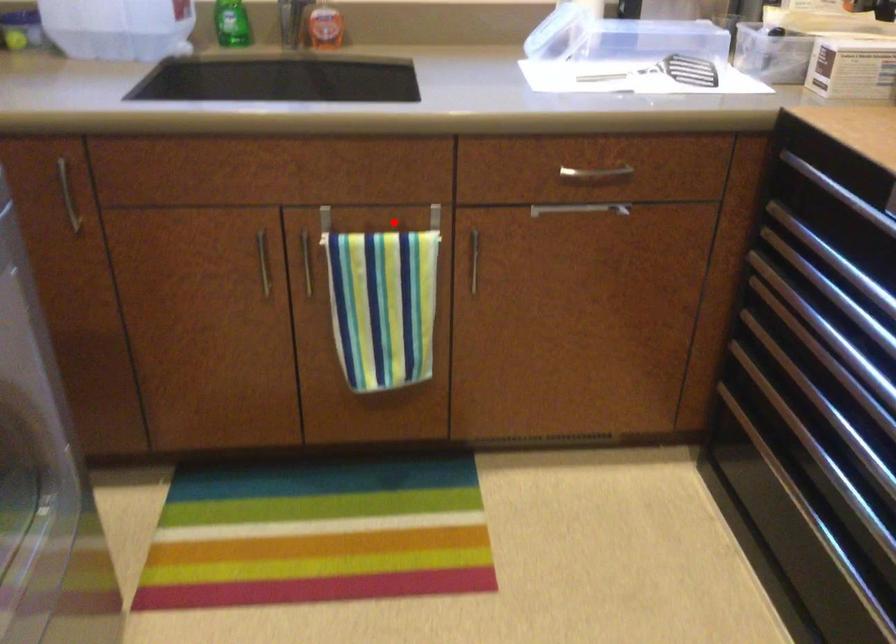
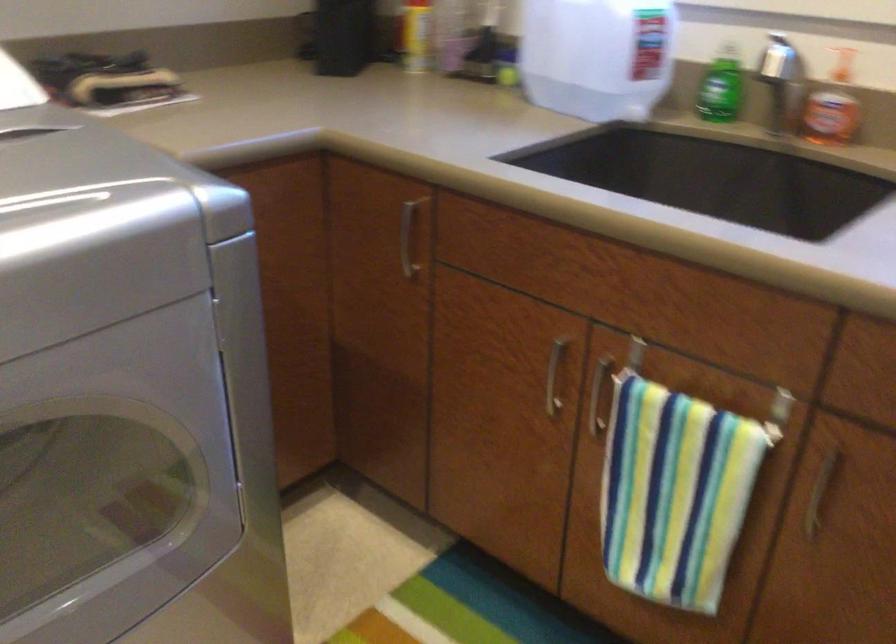
Find the pixel in the second image that matches the highlighted location in the first image.

(727, 393)